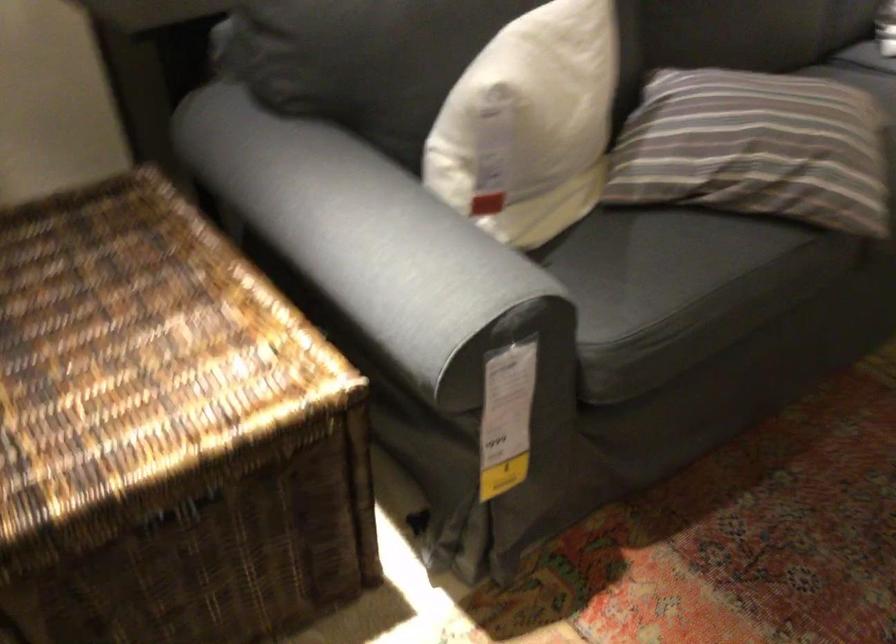
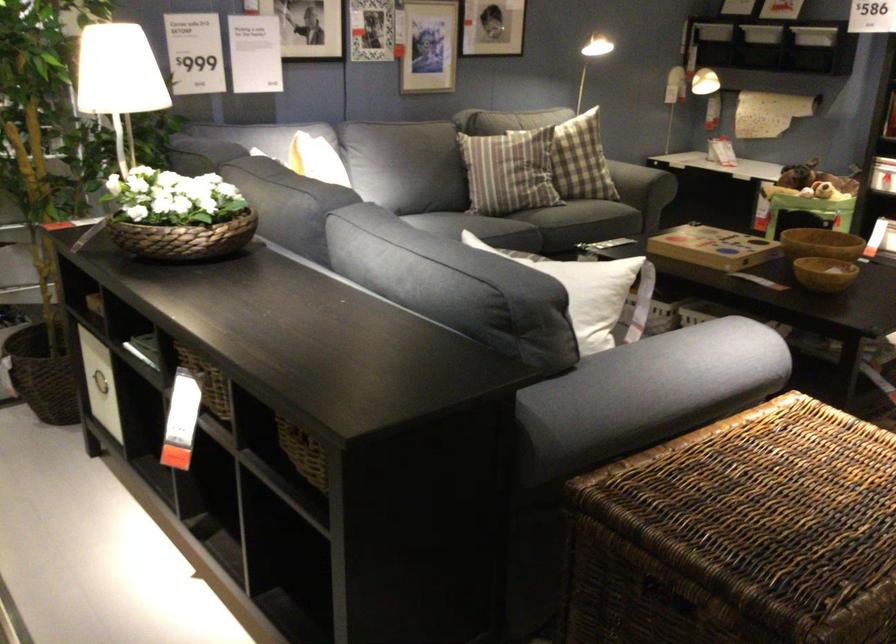
In the second image, find the point that corresponds to the point at 248,243 in the first image.

(647, 393)